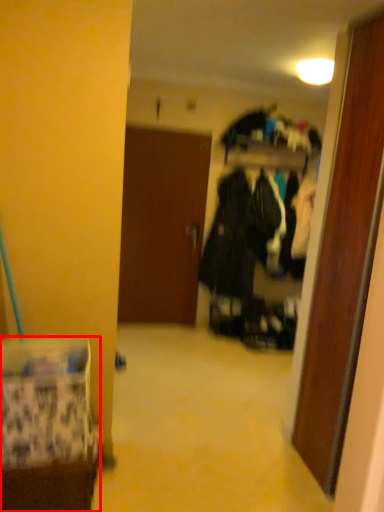
Question: From the image's perspective, what is the correct spatial relationship of furniture (annotated by the red box) in relation to door?

Choices:
 (A) below
 (B) above

Answer: (A)